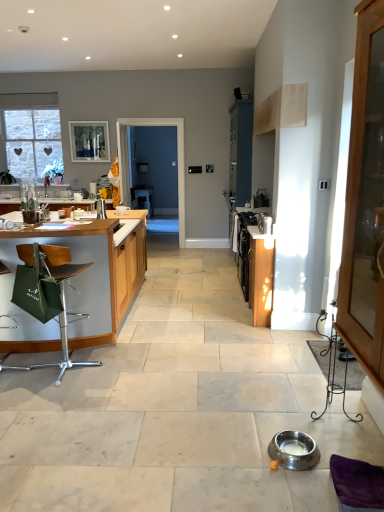
Identify the location of vacant area that lies between green leather chair at left and wooden cabinet at right, arranged as the first cabinetry when viewed from the back. Image resolution: width=384 pixels, height=512 pixels. (178, 340).